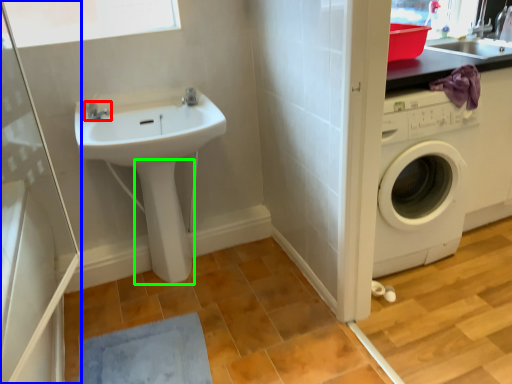
Question: Which object is positioned closest to tap (highlighted by a red box)? Select from screen door (highlighted by a blue box) and bidet (highlighted by a green box).

Choices:
 (A) screen door
 (B) bidet

Answer: (B)